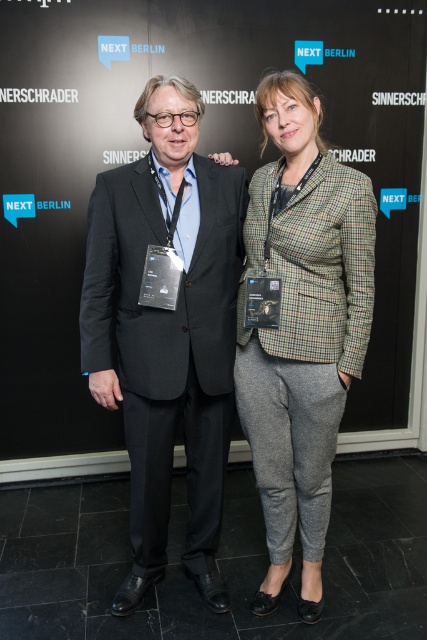
Question: Is black fabric at center above dark gray suit at center?

Choices:
 (A) no
 (B) yes

Answer: (B)

Question: Is black fabric at center positioned behind plaid wool blazer at center?

Choices:
 (A) no
 (B) yes

Answer: (B)

Question: Among these objects, which one is farthest from the camera?

Choices:
 (A) plaid wool blazer at center
 (B) dark gray suit at center

Answer: (A)

Question: Among these objects, which one is nearest to the camera?

Choices:
 (A) black fabric at center
 (B) plaid wool blazer at center
 (C) dark gray suit at center

Answer: (C)

Question: Does dark gray suit at center appear over plaid wool blazer at center?

Choices:
 (A) yes
 (B) no

Answer: (B)

Question: Considering the real-world distances, which object is farthest from the plaid wool blazer at center?

Choices:
 (A) black fabric at center
 (B) dark gray suit at center

Answer: (A)